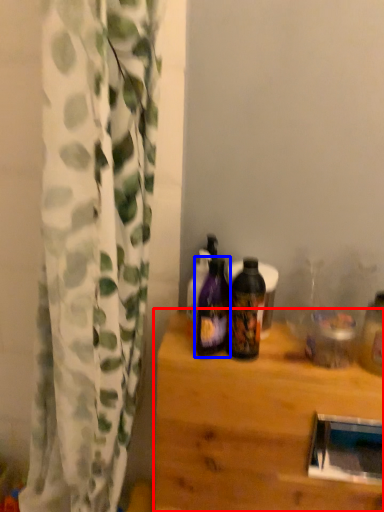
Question: Which object appears closest to the camera in this image, table (highlighted by a red box) or bottle (highlighted by a blue box)?

Choices:
 (A) table
 (B) bottle

Answer: (B)